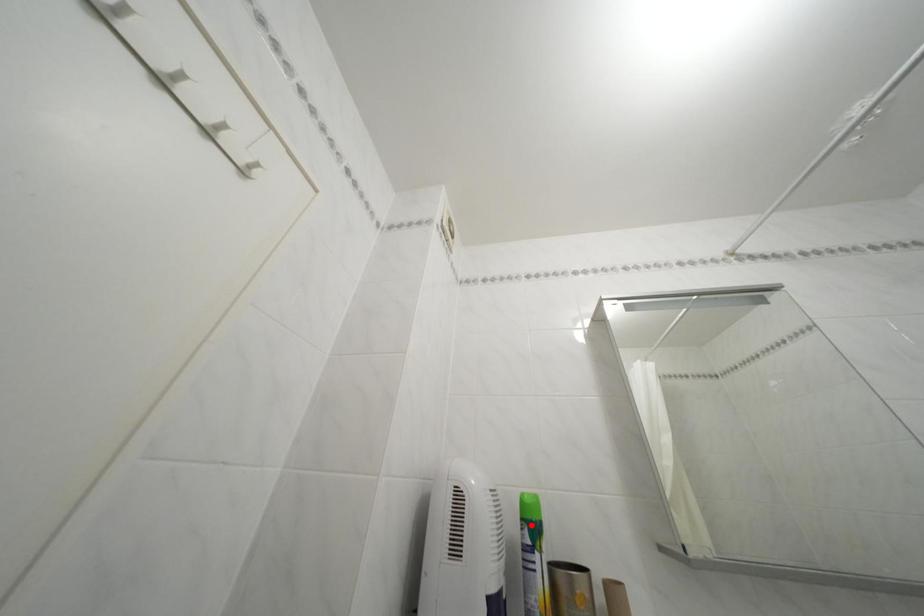
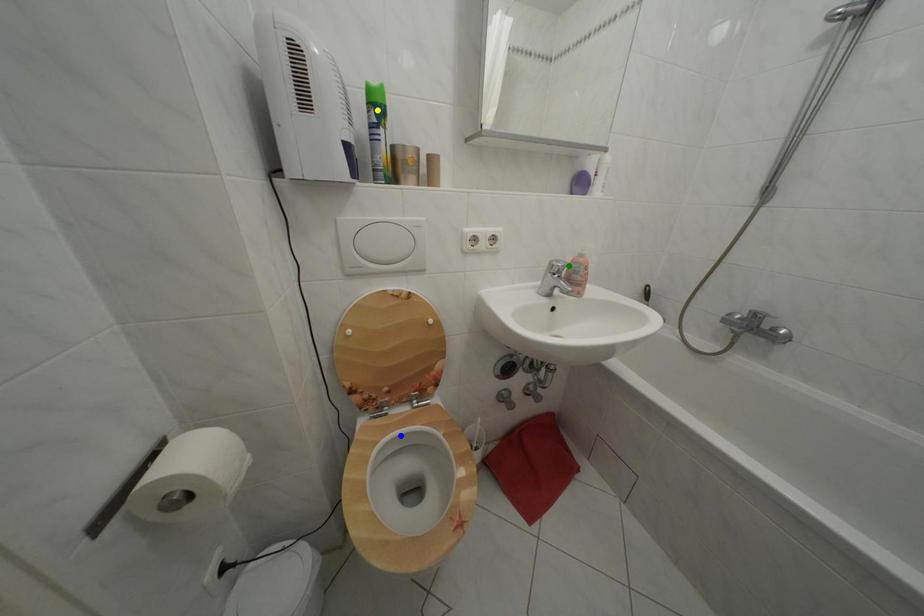
Question: I am providing you with two images of the same scene from different viewpoints. A red point is marked on the first image. You are given multiple points on the second image. Which point in image 2 represents the same 3d spot as the red point in image 1?

Choices:
 (A) blue point
 (B) green point
 (C) yellow point

Answer: (C)